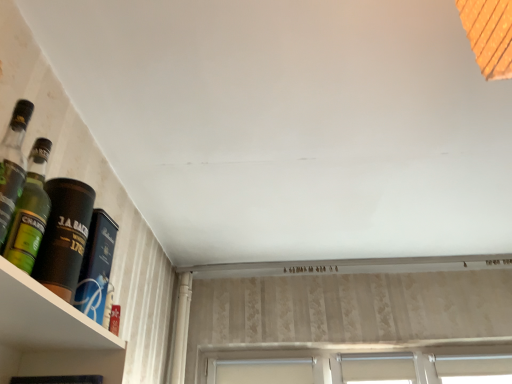
Question: From a real-world perspective, is dark brown leather bottle at left, the 1th bottle viewed from the back, below green glass bottle at left, arranged as the second bottle when viewed from the front?

Choices:
 (A) yes
 (B) no

Answer: (B)

Question: From a real-world perspective, is dark brown leather bottle at left, which appears as the 3th bottle when viewed from the front, over green glass bottle at left, which is counted as the second bottle, starting from the back?

Choices:
 (A) no
 (B) yes

Answer: (B)

Question: Is dark brown leather bottle at left, the 1th bottle viewed from the back, further to the viewer compared to green glass bottle at left, which is counted as the second bottle, starting from the back?

Choices:
 (A) no
 (B) yes

Answer: (B)

Question: Can you confirm if dark brown leather bottle at left, which appears as the 3th bottle when viewed from the front, is smaller than green glass bottle at left, arranged as the second bottle when viewed from the front?

Choices:
 (A) no
 (B) yes

Answer: (B)

Question: Considering the relative sizes of dark brown leather bottle at left, the 1th bottle viewed from the back, and green glass bottle at left, which is counted as the second bottle, starting from the back, in the image provided, is dark brown leather bottle at left, the 1th bottle viewed from the back, shorter than green glass bottle at left, which is counted as the second bottle, starting from the back,?

Choices:
 (A) no
 (B) yes

Answer: (B)

Question: Is dark brown leather bottle at left, which appears as the 3th bottle when viewed from the front, far from green glass bottle at left, which is counted as the second bottle, starting from the back?

Choices:
 (A) yes
 (B) no

Answer: (B)

Question: Is dark brown leather bottle at left, the 1th bottle viewed from the back, at the left side of white fabric window at lower right, which appears as the 1th window when viewed from the right?

Choices:
 (A) yes
 (B) no

Answer: (A)

Question: Is dark brown leather bottle at left, the 1th bottle viewed from the back, completely or partially outside of white fabric window at lower right, which is the third window in left-to-right order?

Choices:
 (A) yes
 (B) no

Answer: (A)

Question: From a real-world perspective, is dark brown leather bottle at left, the 1th bottle viewed from the back, physically below white fabric window at lower right, which appears as the 1th window when viewed from the right?

Choices:
 (A) yes
 (B) no

Answer: (A)

Question: Are dark brown leather bottle at left, the 1th bottle viewed from the back, and white fabric window at lower right, which appears as the 1th window when viewed from the right, making contact?

Choices:
 (A) yes
 (B) no

Answer: (B)

Question: Considering the relative sizes of dark brown leather bottle at left, the 1th bottle viewed from the back, and white fabric window at lower right, which is the third window in left-to-right order, in the image provided, is dark brown leather bottle at left, the 1th bottle viewed from the back, bigger than white fabric window at lower right, which is the third window in left-to-right order,?

Choices:
 (A) yes
 (B) no

Answer: (B)

Question: From a real-world perspective, is dark brown leather bottle at left, which appears as the 3th bottle when viewed from the front, on white fabric window at lower right, which is the third window in left-to-right order?

Choices:
 (A) no
 (B) yes

Answer: (A)

Question: Would you consider white fabric window at lower center, the second window viewed from the right, to be distant from white fabric window at lower right, which is the third window in left-to-right order?

Choices:
 (A) yes
 (B) no

Answer: (B)